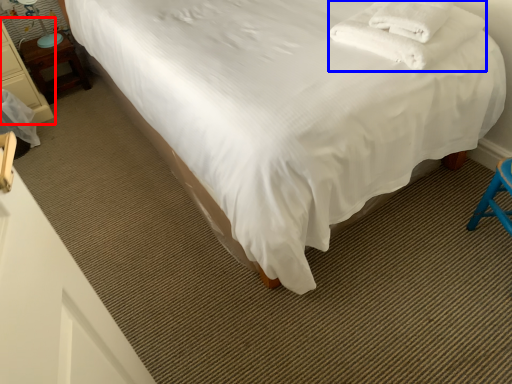
Question: Which object is closer to the camera taking this photo, furniture (highlighted by a red box) or blanket (highlighted by a blue box)?

Choices:
 (A) furniture
 (B) blanket

Answer: (B)